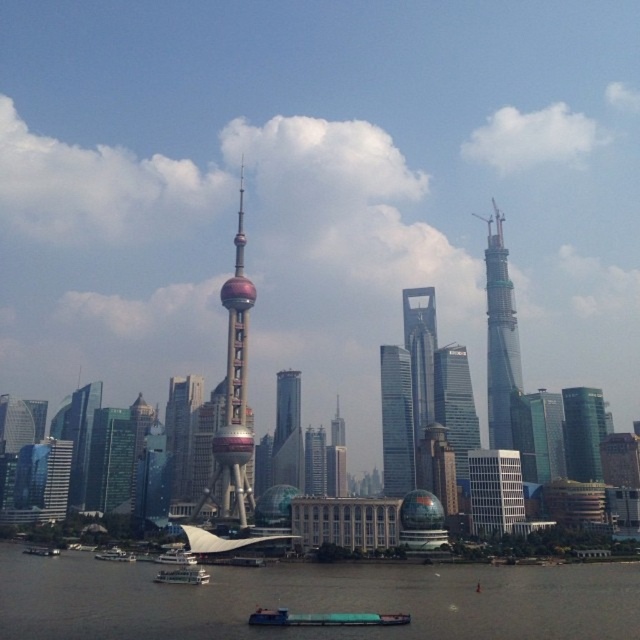
Looking at this image, between sleek glass skyscraper at center-right and green matte boat at center, which one has more height?

sleek glass skyscraper at center-right is taller.

You are a GUI agent. You are given a task and a screenshot of the screen. Output one action in this format:
    pyautogui.click(x=<x>, y=<y>)
    Task: Click on the sleek glass skyscraper at center-right
    This screenshot has width=640, height=640.
    Given the screenshot: What is the action you would take?
    pyautogui.click(x=499, y=336)

Can you confirm if white glossy boat at lower center is positioned to the right of white plastic boat at lower left?

Correct, you'll find white glossy boat at lower center to the right of white plastic boat at lower left.

Who is positioned more to the right, white glossy boat at lower center or white plastic boat at lower left?

white glossy boat at lower center is more to the right.

Is point (166, 552) behind point (104, 557)?

No.

Identify the location of white glossy boat at lower center. (177, 556).

I want to click on shiny glass skyscraper at center, so click(180, 433).

Based on the photo, who is more distant from viewer, (196,378) or (296,460)?

Positioned behind is point (196,378).

Locate an element on the screen. This screenshot has height=640, width=640. shiny glass skyscraper at center is located at coordinates (180, 433).